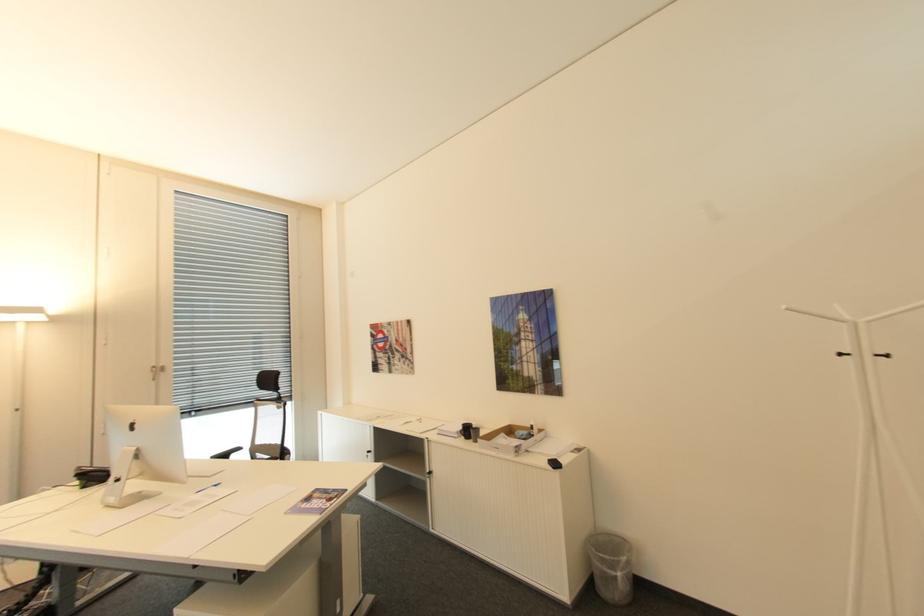
The height and width of the screenshot is (616, 924). Describe the element at coordinates (270, 383) in the screenshot. I see `a black chair armrest` at that location.